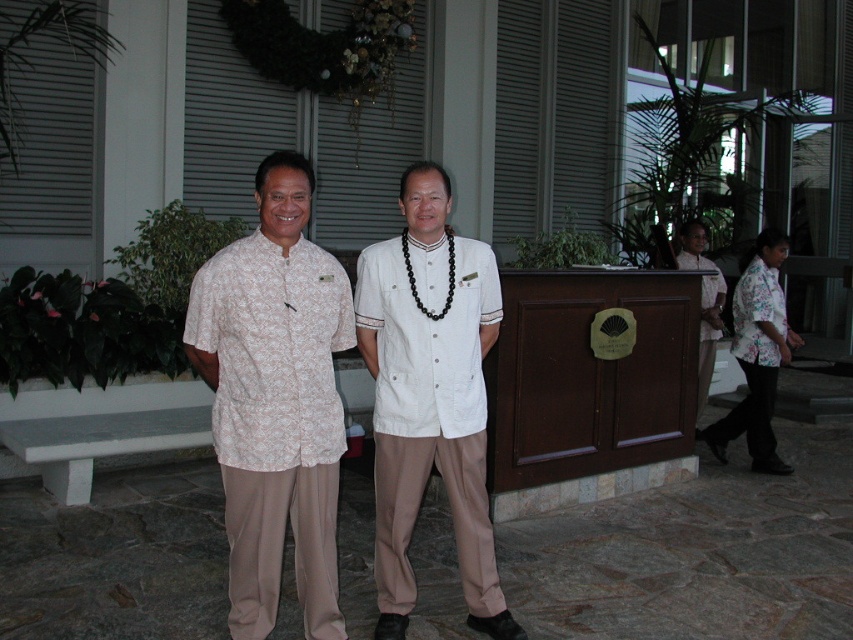
You are a photographer trying to capture a closeup of the white floral shirt at center and the white matte shirt at center. Which one is positioned higher in the frame?

The white floral shirt at center is above the white matte shirt at center, so it is positioned higher in the frame.

You are a photographer trying to position a spotlight at point [428,396]. Which object in the scene is exactly at that coordinate?

The white matte shirt at center is exactly at point [428,396].

You are a photographer adjusting the camera settings to ensure both the white floral shirt at center and the white matte shirt at center are in focus. Given that the depth of field can cover 17 inches, will both shirts be in focus?

The white floral shirt at center is 16.62 inches from the white matte shirt at center. Since the depth of field can cover 17 inches, which is slightly larger than the distance between them, both shirts will be in focus.